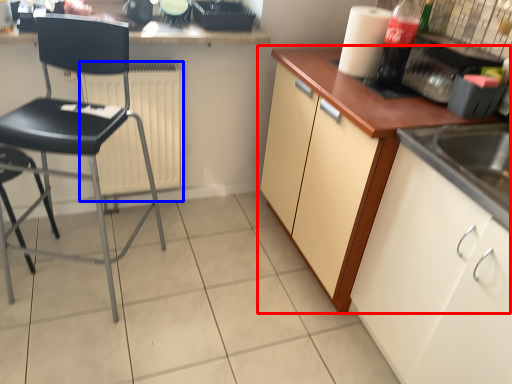
Question: Which point is closer to the camera, cabinetry (highlighted by a red box) or radiator (highlighted by a blue box)?

Choices:
 (A) cabinetry
 (B) radiator

Answer: (A)